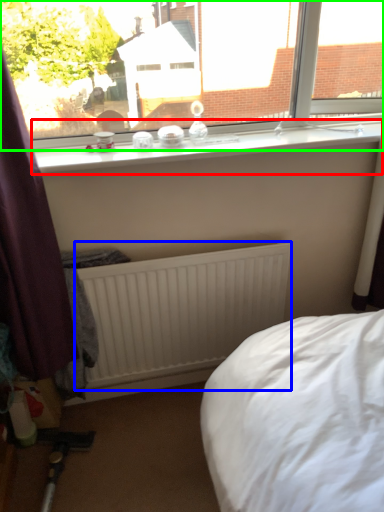
Question: Which object is the farthest from window sill (highlighted by a red box)? Choose among these: radiator (highlighted by a blue box) or window (highlighted by a green box).

Choices:
 (A) radiator
 (B) window

Answer: (A)